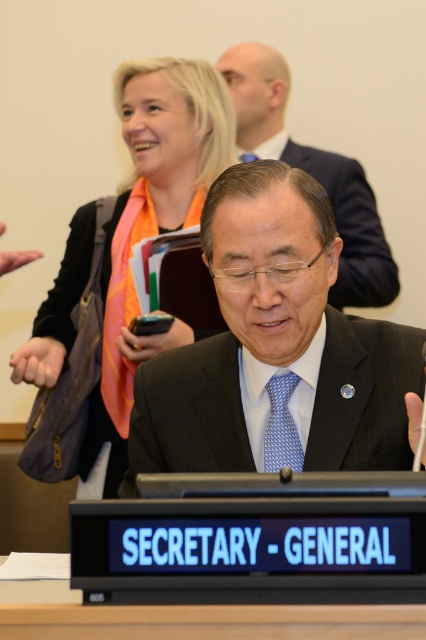
You are attending a formal conference and notice two items in the scene. One is the orange scarf at upper left and the other is the black suit at center. Which of these items is located lower in the image?

The orange scarf at upper left is positioned under the black suit at center, meaning it is lower in the image.

You are standing in the conference room and want to determine which point is nearer to you. The points are located at coordinates point (402, 467) and point (118, 276). Which point is closer to you?

Point (402, 467) is closer to the viewer than point (118, 276).

You are attending a formal meeting and need to place a document on the table without covering the nameplate. Can you place it on the wooden table at center where the black matte suit at center is currently located?

The black matte suit at center is positioned over the wooden table at center, so placing the document there would cover the nameplate. Choose another spot on the wooden table at center instead.